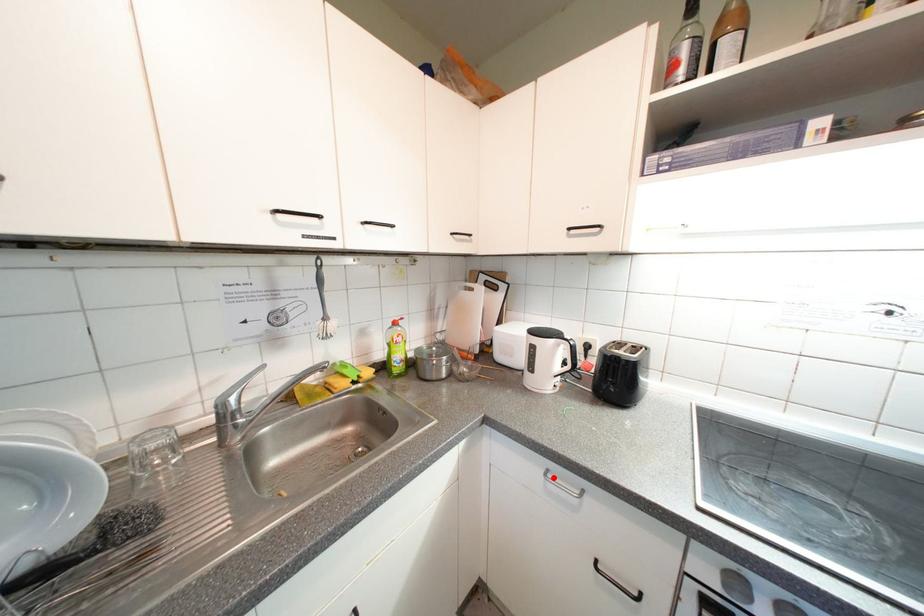
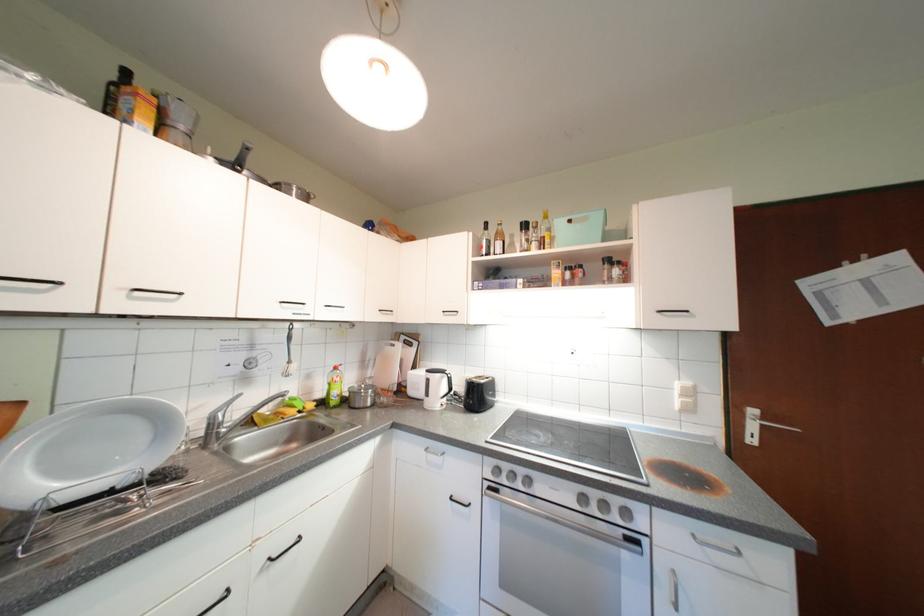
Find the pixel in the second image that matches the highlighted location in the first image.

(433, 453)